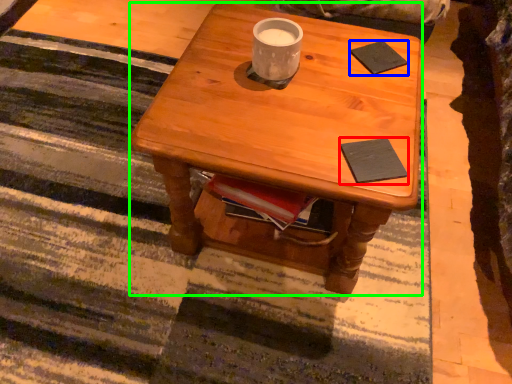
Question: Which is farther away from pad (highlighted by a red box)? pad (highlighted by a blue box) or desk (highlighted by a green box)?

Choices:
 (A) pad
 (B) desk

Answer: (A)